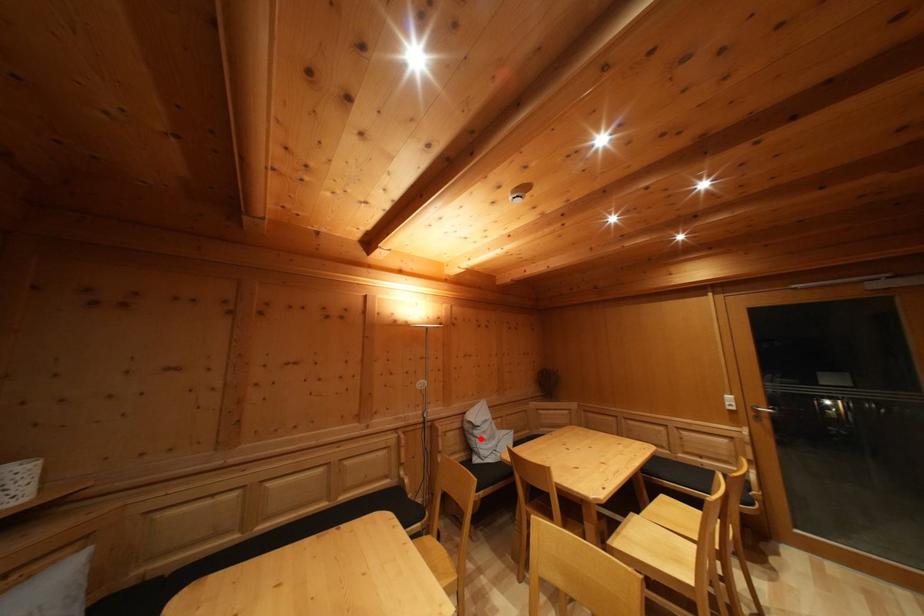
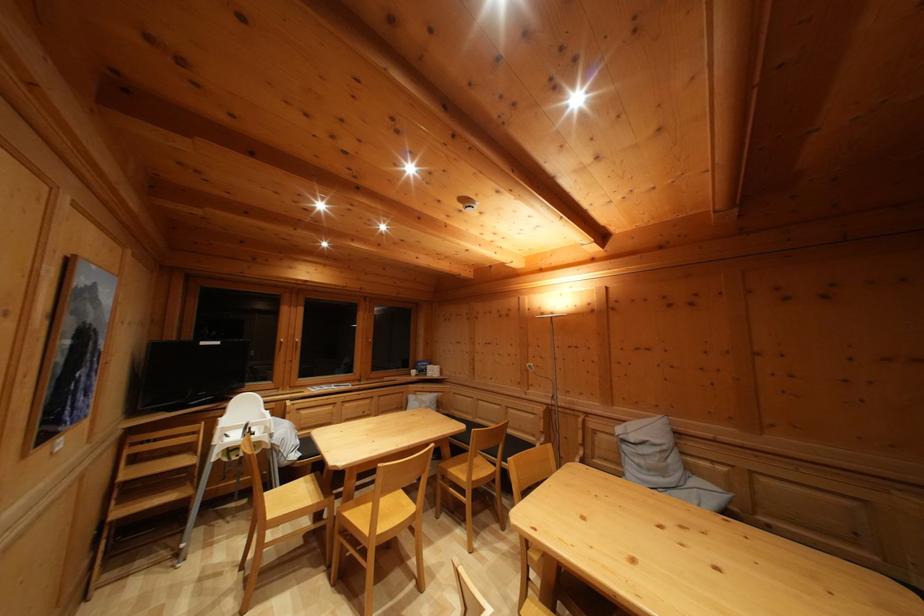
Question: I am providing you with two images of the same scene from different viewpoints. A red point is marked on the first image. Is the red point's position out of view in image 2?

Choices:
 (A) Yes
 (B) No

Answer: (B)